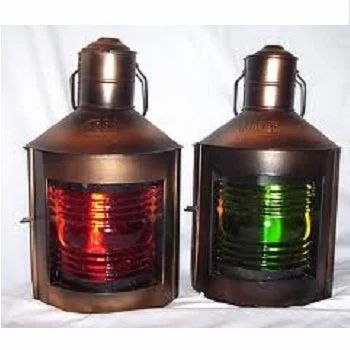
This screenshot has height=350, width=350. I want to click on left handle, so click(x=236, y=98).